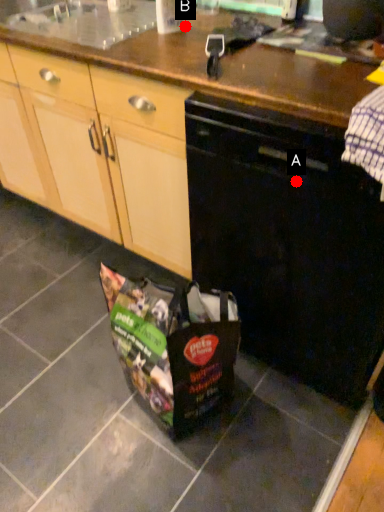
Question: Two points are circled on the image, labeled by A and B beside each circle. Among these points, which one is farthest from the camera?

Choices:
 (A) A is further
 (B) B is further

Answer: (B)